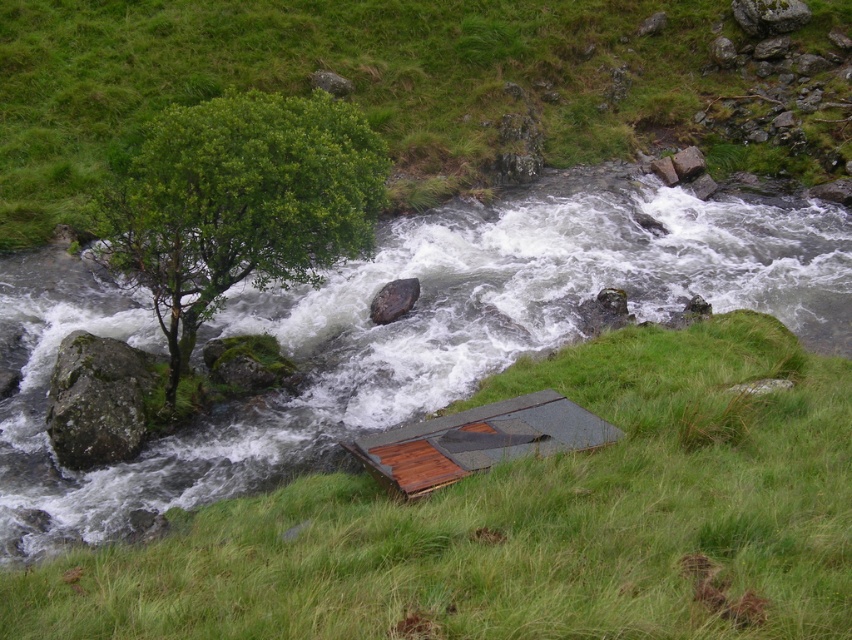
Can you confirm if green grassy at lower center is shorter than green mossy rock at left?

Yes.

Which is in front, point (527, 563) or point (78, 426)?

Positioned in front is point (527, 563).

Does point (498, 486) come behind point (96, 429)?

No, it is not.

At what (x,y) coordinates should I click in order to perform the action: click on green grassy at lower center. Please return your answer as a coordinate pair (x, y). The image size is (852, 640). Looking at the image, I should click on (527, 522).

Is gray/wooden hut at lower center positioned behind gray rock at upper right?

No, it is in front of gray rock at upper right.

Who is more distant from viewer, (584,426) or (672,164)?

The point (672,164) is more distant.

This screenshot has height=640, width=852. Find the location of `gray/wooden hut at lower center`. gray/wooden hut at lower center is located at coordinates (478, 440).

Does green leafy tree at upper left have a smaller size compared to gray rock at upper center?

Incorrect, green leafy tree at upper left is not smaller in size than gray rock at upper center.

Is green leafy tree at upper left to the left of gray rock at upper center from the viewer's perspective?

Incorrect, green leafy tree at upper left is not on the left side of gray rock at upper center.

Which is behind, point (325, 214) or point (314, 77)?

The point (314, 77) is more distant.

Where is `green leafy tree at upper left`? green leafy tree at upper left is located at coordinates (240, 204).